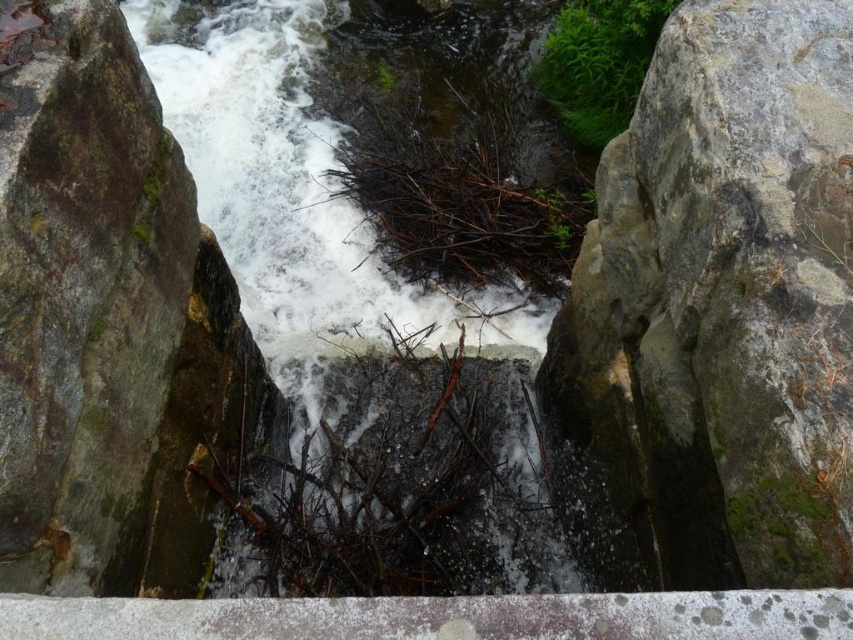
Is gray rough rock at center positioned behind white frothy water at center?

No, gray rough rock at center is closer to the viewer.

Is gray rough rock at center smaller than white frothy water at center?

Yes, gray rough rock at center is smaller than white frothy water at center.

Between point (769, 497) and point (320, 240), which one is positioned in front?

Point (769, 497) is more forward.

Locate an element on the screen. This screenshot has width=853, height=640. gray rough rock at center is located at coordinates (723, 300).

In the scene shown: Does gray rough rock at center appear under green mossy rock at left?

No.

Does gray rough rock at center lie in front of green mossy rock at left?

Yes, it is in front of green mossy rock at left.

Between point (625, 138) and point (152, 330), which one is positioned behind?

The point (625, 138) is more distant.

I want to click on gray rough rock at center, so click(723, 300).

Is green mossy rock at left closer to the viewer compared to brown woody twig at center?

That is True.

Which is in front, point (50, 33) or point (366, 356)?

Positioned in front is point (50, 33).

This screenshot has width=853, height=640. Identify the location of green mossy rock at left. (109, 326).